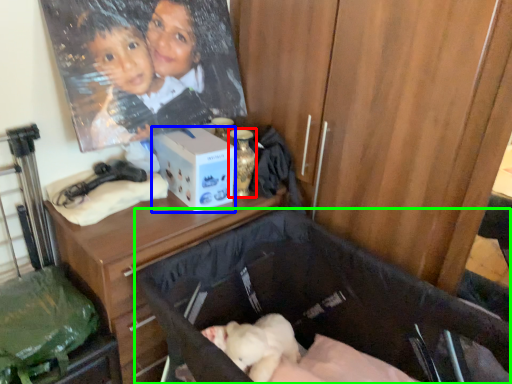
Question: Which is farther away from bottle (highlighted by a red box)? box (highlighted by a blue box) or baby carriage (highlighted by a green box)?

Choices:
 (A) box
 (B) baby carriage

Answer: (B)